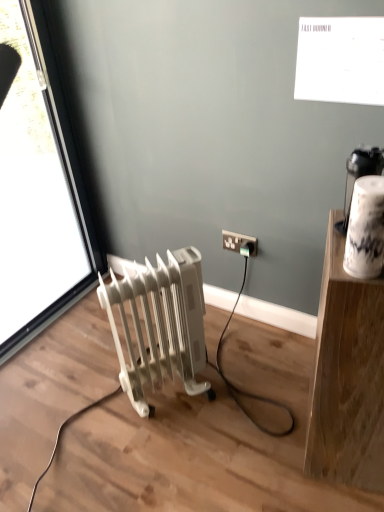
At what (x,y) coordinates should I click in order to perform the action: click on free space behind white wood shelf at upper right. Please return your answer as a coordinate pair (x, y). The image size is (384, 512). Looking at the image, I should click on pos(284,376).